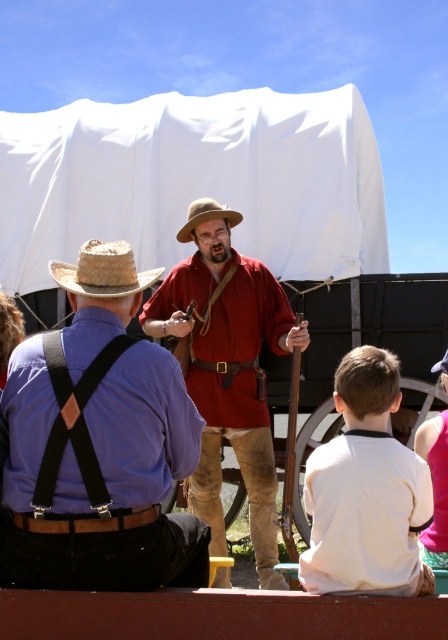
Can you confirm if strawhat at left is shorter than strawmaterial/texturehat at center?

No, strawhat at left is not shorter than strawmaterial/texturehat at center.

Can you confirm if strawhat at left is bigger than strawmaterial/texturehat at center?

Yes.

The image size is (448, 640). I want to click on strawhat at left, so click(103, 269).

Is matte red shirt at center above strawhat at left?

No, matte red shirt at center is not above strawhat at left.

Between matte red shirt at center and strawhat at left, which one is positioned higher?

strawhat at left is above.

Where is `matte red shirt at center`? This screenshot has height=640, width=448. matte red shirt at center is located at coordinates (228, 376).

Does strawhat at left appear over pink fabric shirt at lower right?

Correct, strawhat at left is located above pink fabric shirt at lower right.

Is strawhat at left behind pink fabric shirt at lower right?

Yes, it is behind pink fabric shirt at lower right.

The image size is (448, 640). I want to click on strawhat at left, so click(103, 269).